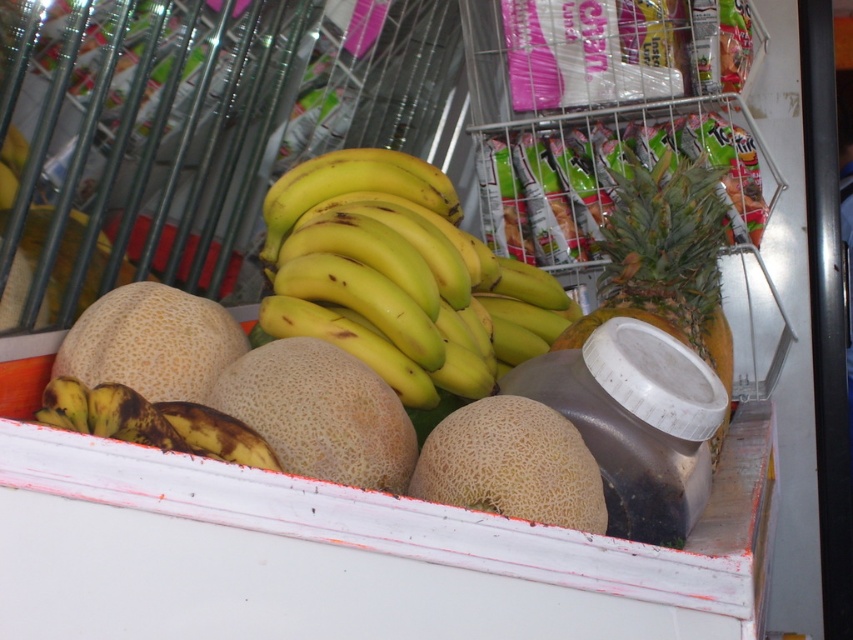
Question: Is green spiky pineapple at center in front of brown spotted banana at lower left?

Choices:
 (A) no
 (B) yes

Answer: (A)

Question: Considering the real-world distances, which object is farthest from the green spiky pineapple at center?

Choices:
 (A) light brown textured cantaloupe at center
 (B) speckled beige cantaloupe at lower left

Answer: (A)

Question: Which is farther from the speckled beige cantaloupe at lower left?

Choices:
 (A) brown spotted banana at lower left
 (B) green spiky pineapple at center
 (C) light brown textured cantaloupe at center

Answer: (B)

Question: Where is light brown textured cantaloupe at center located in relation to brown spotted banana at lower left in the image?

Choices:
 (A) above
 (B) below

Answer: (B)

Question: Does yellow matte bananas at center appear on the left side of speckled beige cantaloupe at lower left?

Choices:
 (A) no
 (B) yes

Answer: (A)

Question: Which point appears farthest from the camera in this image?

Choices:
 (A) (550, 420)
 (B) (210, 429)
 (C) (309, 397)
 (D) (671, 188)

Answer: (D)